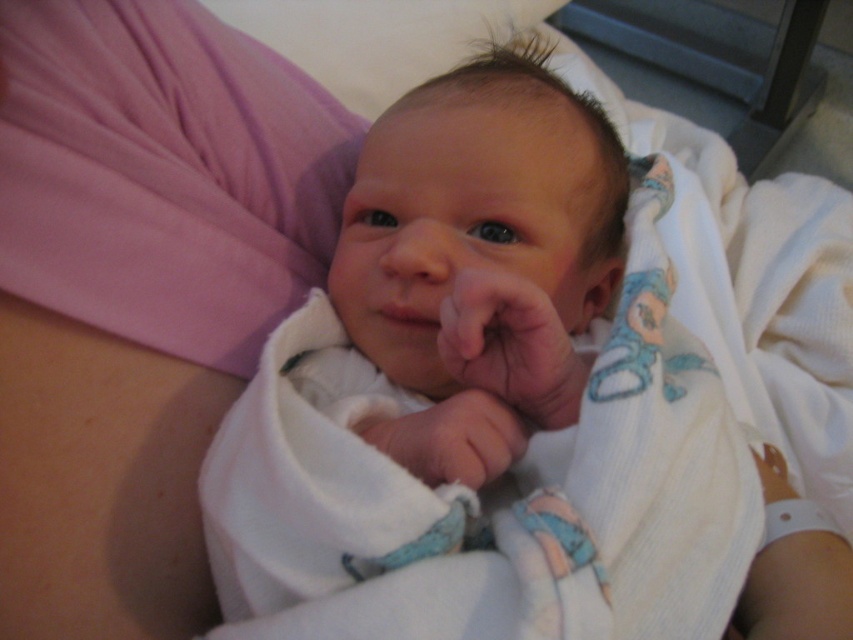
Is white soft swaddle at center taller than white soft fabric hand at center?

Yes.

Is white soft swaddle at center positioned before white soft fabric hand at center?

Yes, white soft swaddle at center is closer to the viewer.

You are a GUI agent. You are given a task and a screenshot of the screen. Output one action in this format:
    pyautogui.click(x=<x>, y=<y>)
    Task: Click on the white soft swaddle at center
    The height and width of the screenshot is (640, 853).
    Given the screenshot: What is the action you would take?
    [486, 397]

Does smooth skin hand at center appear on the left side of white soft fabric hand at center?

In fact, smooth skin hand at center is to the right of white soft fabric hand at center.

Who is more forward, (535, 369) or (387, 426)?

Point (535, 369) is in front.

This screenshot has height=640, width=853. In order to click on smooth skin hand at center in this screenshot , I will do `click(511, 346)`.

Can you confirm if white soft swaddle at center is positioned above smooth skin hand at center?

Yes, white soft swaddle at center is above smooth skin hand at center.

Between white soft swaddle at center and smooth skin hand at center, which one appears on the left side from the viewer's perspective?

From the viewer's perspective, smooth skin hand at center appears more on the left side.

Which is in front, point (451, 182) or point (555, 314)?

Positioned in front is point (555, 314).

Find the location of `white soft swaddle at center`. white soft swaddle at center is located at coordinates (486, 397).